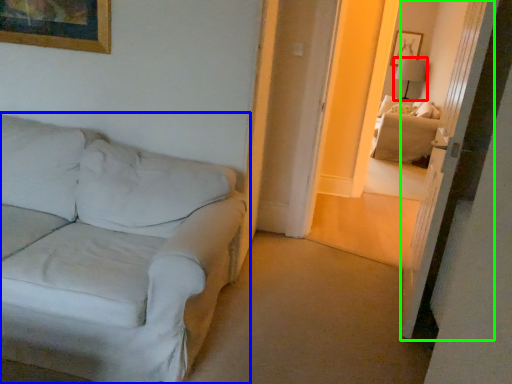
Question: Estimate the real-world distances between objects in this image. Which object is closer to table lamp (highlighted by a red box), studio couch (highlighted by a blue box) or glass door (highlighted by a green box)?

Choices:
 (A) studio couch
 (B) glass door

Answer: (B)